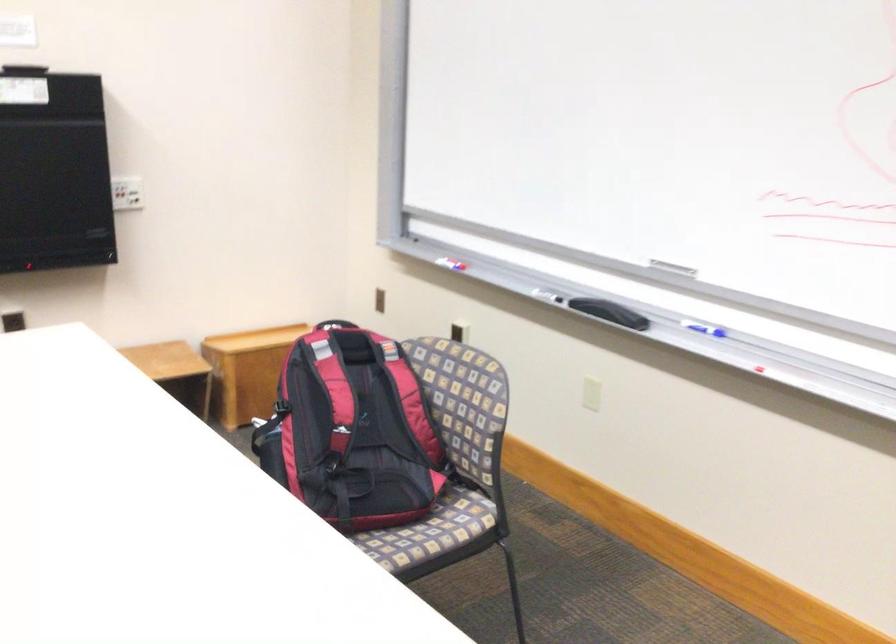
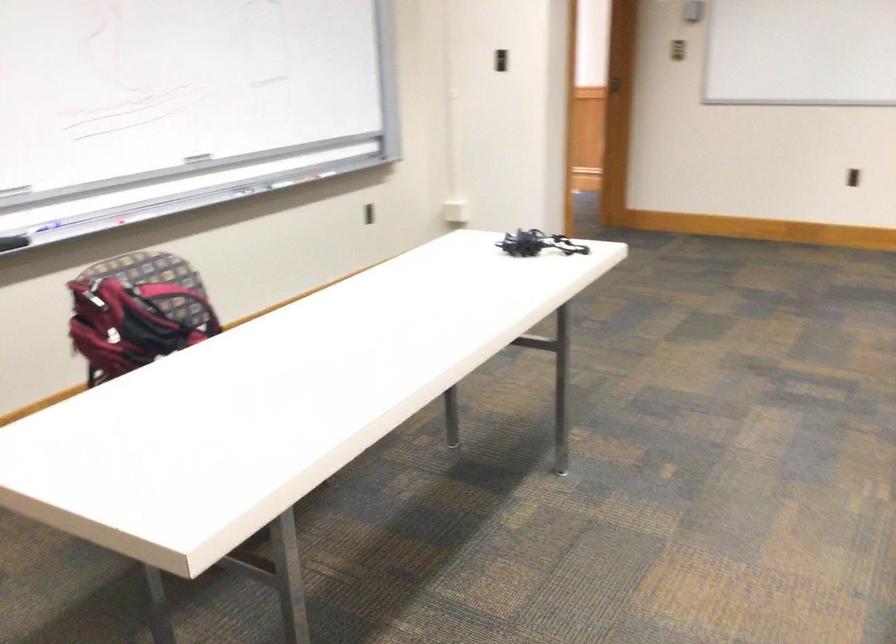
Question: I am providing you with two images of the same scene from different viewpoints. After the viewpoint changes to image2, which objects are now occluded?

Choices:
 (A) orange coffee mug
 (B) blue whiteboard marker
 (C) black whiteboard eraser
 (D) black backpack handle

Answer: (D)